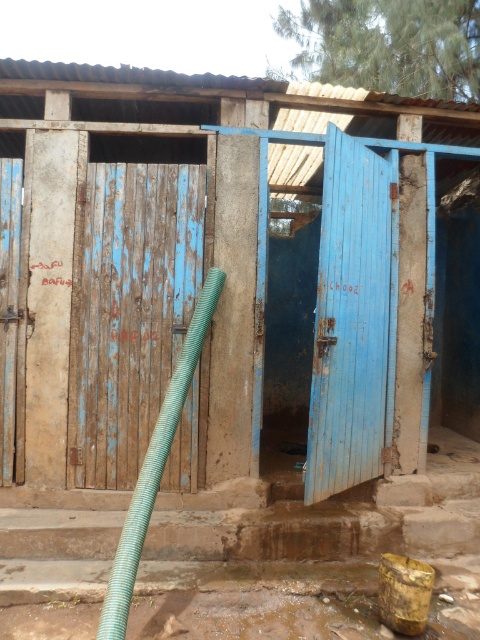
Question: Among these objects, which one is nearest to the camera?

Choices:
 (A) blue wooden door at left
 (B) green corrugated hose at left

Answer: (B)

Question: Which of the following is the closest to the observer?

Choices:
 (A) (365, 312)
 (B) (117, 580)
 (C) (13, 163)

Answer: (B)

Question: Does weathered wood door at center have a lesser width compared to green corrugated hose at left?

Choices:
 (A) no
 (B) yes

Answer: (A)

Question: Does blue painted wood door at center have a smaller size compared to blue wooden door at left?

Choices:
 (A) no
 (B) yes

Answer: (A)

Question: Which object is closer to the camera taking this photo?

Choices:
 (A) blue wooden door at left
 (B) blue painted wood door at center
 (C) green corrugated hose at left
 (D) weathered wood door at center

Answer: (C)

Question: Is weathered wood door at center smaller than blue wooden door at left?

Choices:
 (A) yes
 (B) no

Answer: (B)